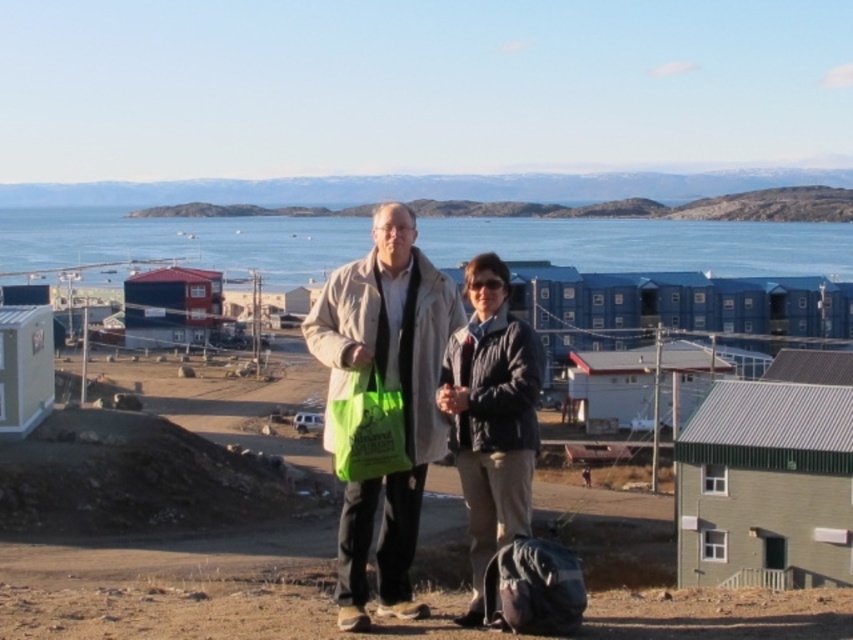
You are a photographer trying to capture the scenic view of the coastal town. You notice the blue water at center and the dark blue quilted jacket at center in your frame. Which object is positioned more to the left in the image?

The blue water at center is positioned on the left side of dark blue quilted jacket at center, so it is more to the left.

You are a photographer trying to capture a clear shot of the dark blue quilted jacket at center and the green plastic bag at center. Which object should you zoom in on to ensure it fills the frame better?

The dark blue quilted jacket at center is larger in size than the green plastic bag at center, so zooming in on the dark blue quilted jacket at center will ensure it fills the frame better.

You are standing at point (500, 298) and want to take a photo of the scenic coastal town in the background. The camera you have can only focus on objects within 15 meters. Will the camera be able to focus on the coastal town in the background?

The distance between point (500, 298) and the camera is 15.54 meters, which is beyond the camera focus range of 15 meters. Therefore, the camera will not be able to focus on the coastal town in the background.